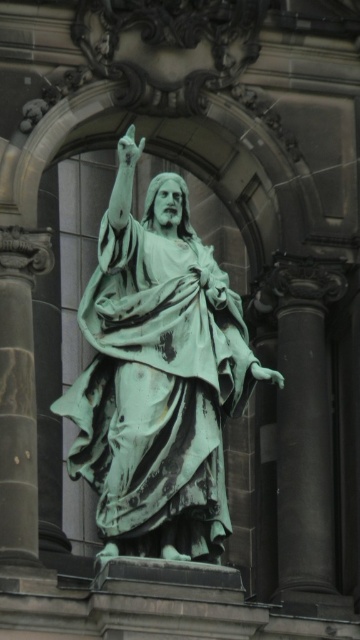
Question: Which object is closer to the camera taking this photo?

Choices:
 (A) green marble pillar at right
 (B) green patina statue at center
 (C) green patina stone pillar at left

Answer: (C)

Question: Can you confirm if green marble pillar at right is thinner than green patina stone pillar at left?

Choices:
 (A) yes
 (B) no

Answer: (B)

Question: Which of the following is the farthest from the observer?

Choices:
 (A) (74, 388)
 (B) (291, 300)
 (C) (2, 589)

Answer: (B)

Question: Is green marble pillar at right to the right of green patina stone pillar at left from the viewer's perspective?

Choices:
 (A) no
 (B) yes

Answer: (B)

Question: Can you confirm if green patina statue at center is positioned below green patina stone pillar at left?

Choices:
 (A) yes
 (B) no

Answer: (B)

Question: Which point is closer to the camera taking this photo?

Choices:
 (A) (307, 392)
 (B) (145, 522)
 (C) (11, 550)

Answer: (B)